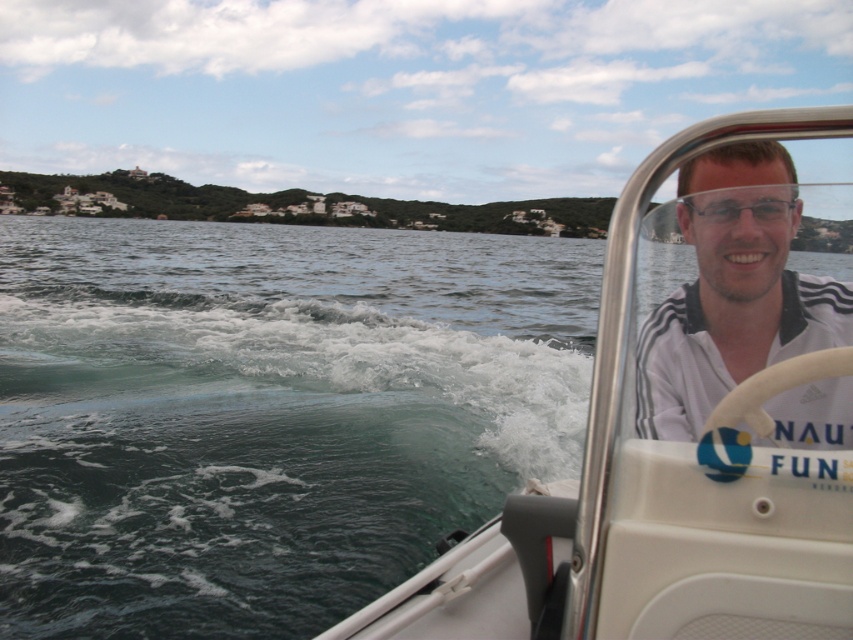
From the picture: You are a photographer trying to capture the white plastic boat at right from the point at point (x=691, y=432). Is the boat visible from this point?

The white plastic boat at right is located at point (x=691, y=432), so yes, it is visible from that point.

You are a photographer trying to capture the white plastic boat at right and the white frothy water at lower left in a single shot. Based on their positions, will you need to pan your camera to the right or left to include both in the frame?

The white plastic boat at right is to the right of white frothy water at lower left, so you need to pan your camera to the right to include both in the frame.

You are standing on a dock and want to reach the point marked as point (119, 392) in the water. If your boat can travel 10 meters before needing to refuel, will you be able to reach that point without refueling?

The distance between you and point (119, 392) is 9.30 meters. Since your boat can travel 10 meters before needing to refuel, you can reach the point without refueling.